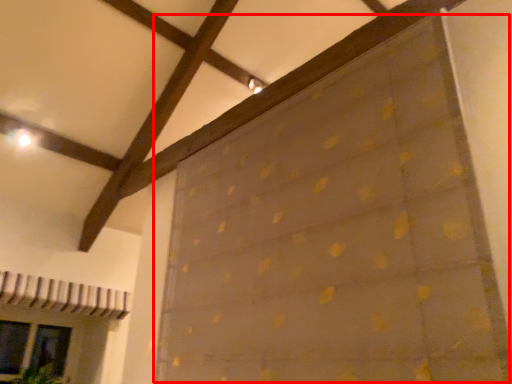
Question: From the image's perspective, what is the correct spatial relationship of curtain (annotated by the red box) in relation to glass door?

Choices:
 (A) below
 (B) above

Answer: (B)